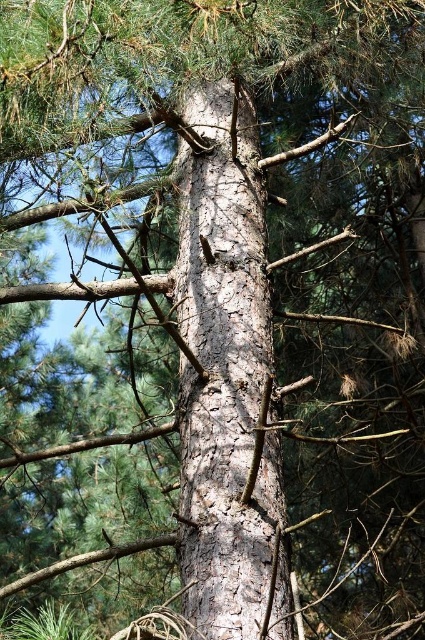
Question: Where is brown rough branch at lower left located in relation to brown rough branch at upper left in the image?

Choices:
 (A) above
 (B) below

Answer: (B)

Question: Can you confirm if brown rough branch at lower left is bigger than brown rough branch at upper left?

Choices:
 (A) no
 (B) yes

Answer: (B)

Question: Which object is closer to the camera taking this photo?

Choices:
 (A) brown rough branch at lower left
 (B) brown rough branch at upper left

Answer: (A)

Question: Does brown rough branch at lower left come behind brown rough branch at upper left?

Choices:
 (A) no
 (B) yes

Answer: (A)